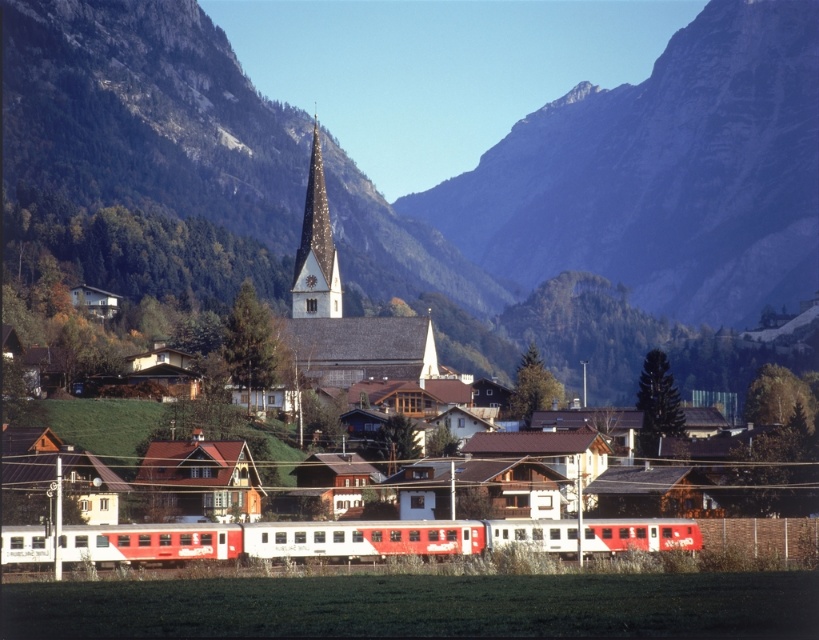
You are a photographer planning to take a photo of the white glossy passenger train at center and the gold textured spire at center. Based on their positions, which object would appear closer to the camera in the final image?

The white glossy passenger train at center appears closer to the camera because it is positioned under the gold textured spire at center, indicating it is in front of the spire.

You are an architect designing a new observation deck in the village. You want to ensure that the gold textured spire at center remains visible from the deck. Given the position of the rugged stone mountain at center, will the mountain block the view of the spire?

The rugged stone mountain at center is further to the viewer than the gold textured spire at center, so the mountain is closer to the observation deck. This means the mountain will block the view of the spire unless the deck is positioned in a way that allows a clear line of sight beyond the mountain.